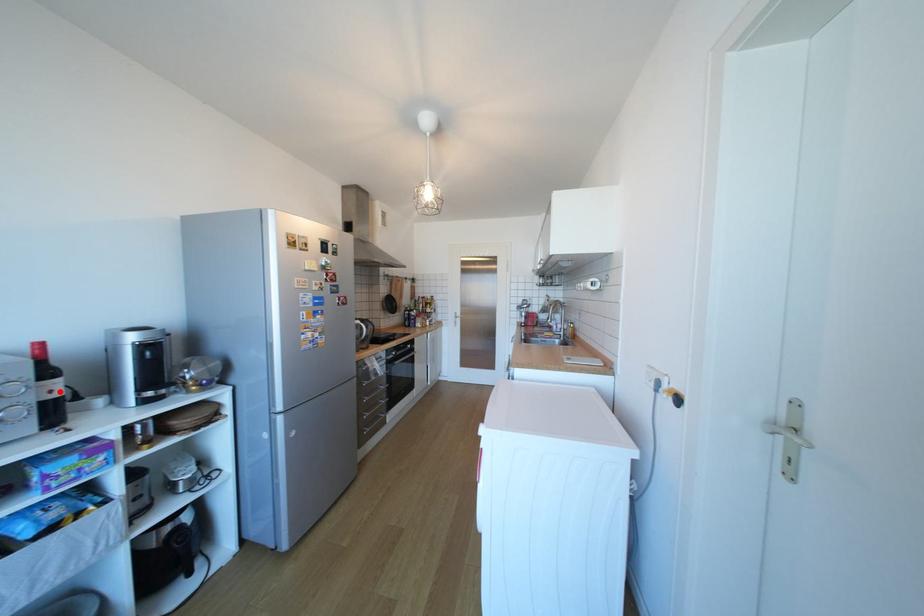
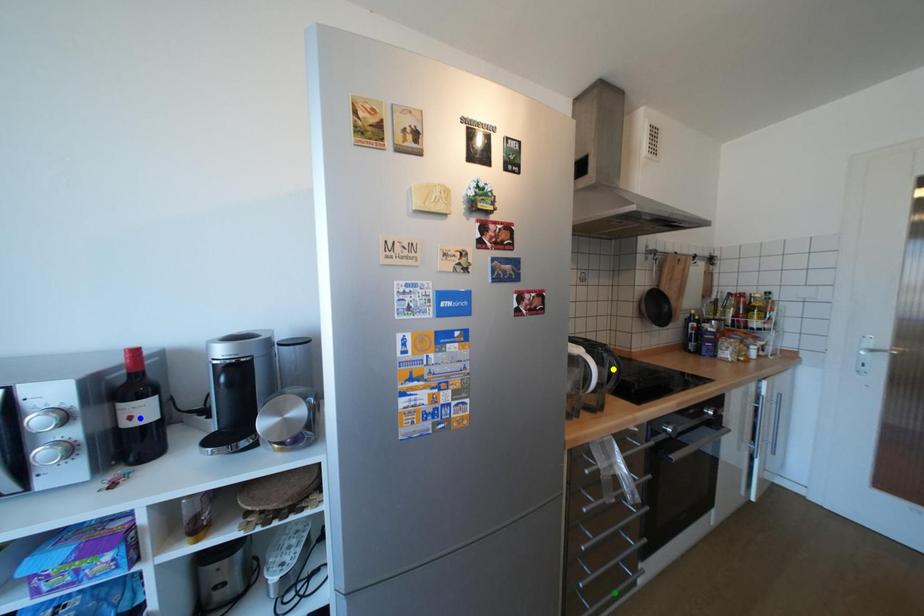
Question: I am providing you with two images of the same scene from different viewpoints. A red point is marked on the first image. You are given multiple points on the second image. In image 2, which mark is for the same physical point as the one in image 1?

Choices:
 (A) green point
 (B) blue point
 (C) yellow point

Answer: (B)